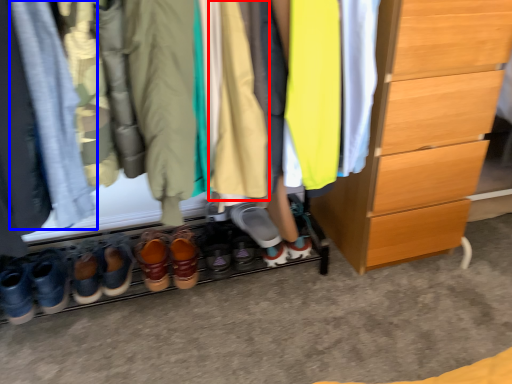
Question: Which object appears closest to the camera in this image, clothing (highlighted by a red box) or clothing (highlighted by a blue box)?

Choices:
 (A) clothing
 (B) clothing

Answer: (B)